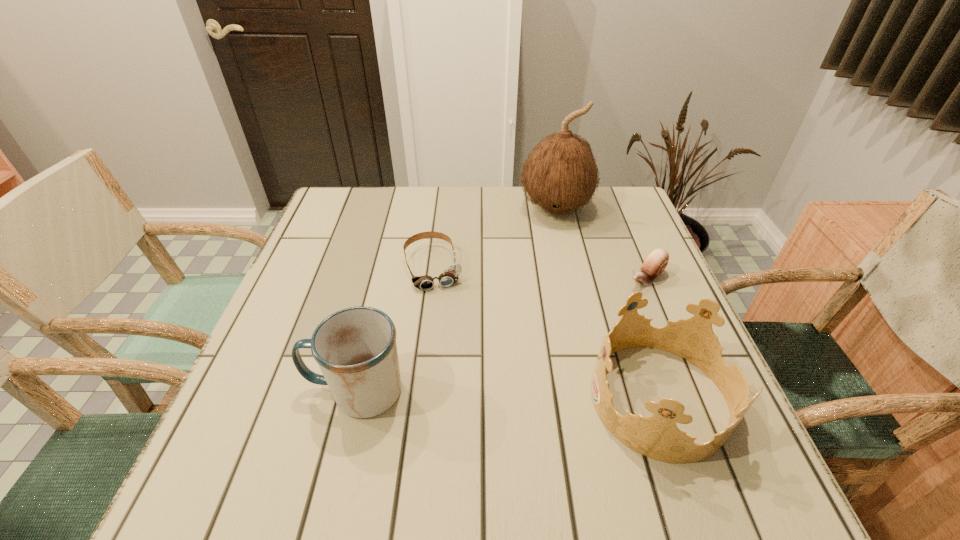
You are a GUI agent. You are given a task and a screenshot of the screen. Output one action in this format:
    pyautogui.click(x=<x>, y=<y>)
    Task: Click on the object at the far edge
    
    Given the screenshot: What is the action you would take?
    pyautogui.click(x=560, y=175)

Image resolution: width=960 pixels, height=540 pixels. I want to click on mug present at the near edge, so click(x=356, y=350).

Image resolution: width=960 pixels, height=540 pixels. Identify the location of tiara situated at the near edge. (658, 437).

Where is `object at the left edge`? The height and width of the screenshot is (540, 960). object at the left edge is located at coordinates (356, 350).

This screenshot has height=540, width=960. In order to click on tiara positioned at the right edge in this screenshot , I will do `click(658, 437)`.

Locate an element on the screen. coconut that is at the right edge is located at coordinates (560, 175).

Where is `escargot positioned at the right edge`? This screenshot has height=540, width=960. escargot positioned at the right edge is located at coordinates (656, 261).

Where is `object at the near left corner`? This screenshot has height=540, width=960. object at the near left corner is located at coordinates (356, 350).

Find the location of a particular element. object located at the far right corner is located at coordinates (560, 175).

At what (x,y) coordinates should I click in order to perform the action: click on object that is positioned at the near right corner. Please return your answer as a coordinate pair (x, y). This screenshot has width=960, height=540. Looking at the image, I should click on (658, 437).